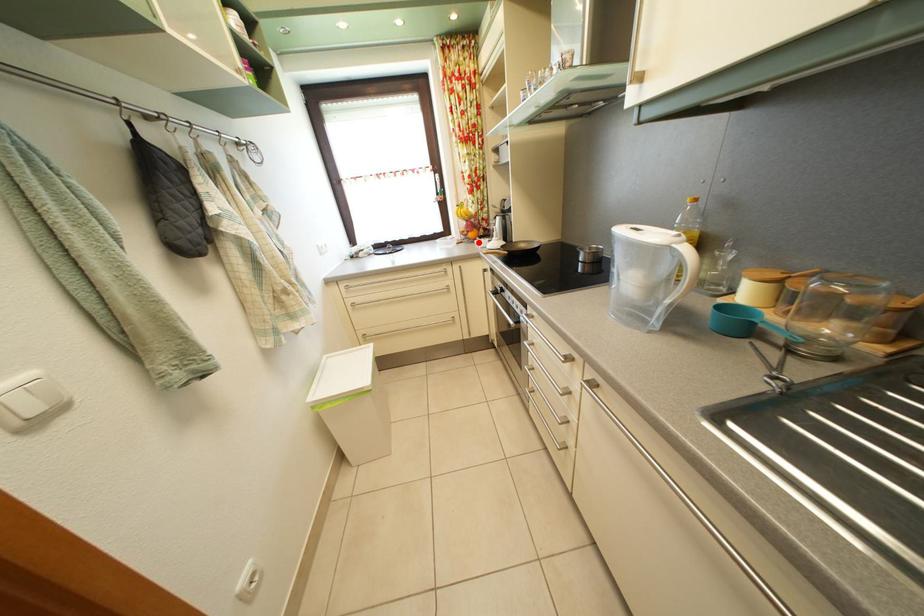
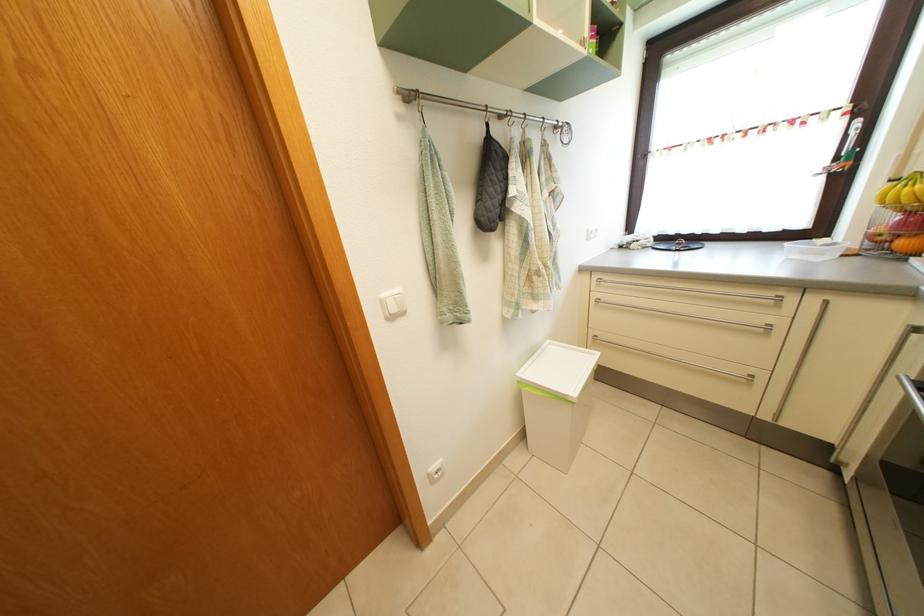
Find the pixel in the second image that matches the highlighted location in the first image.

(910, 252)